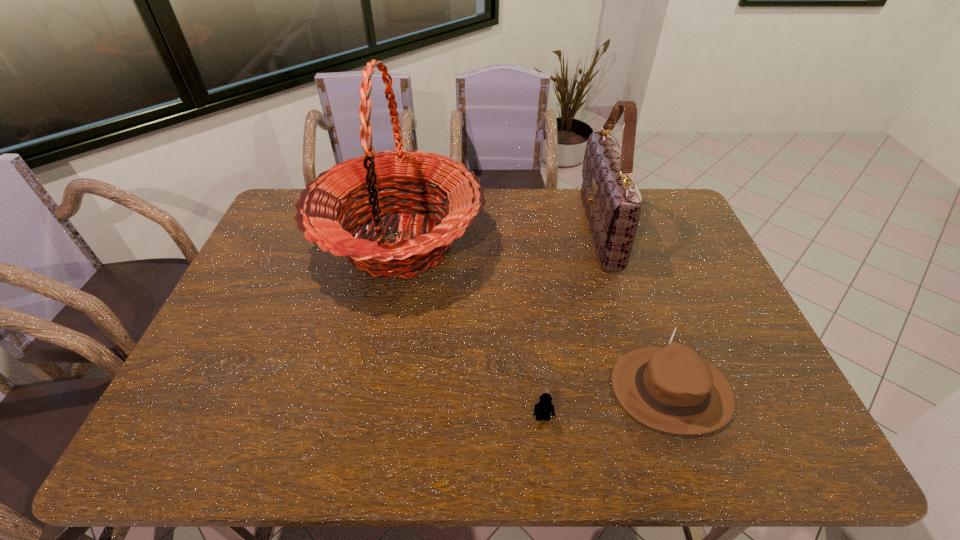
Where is `the tallest object`? The width and height of the screenshot is (960, 540). the tallest object is located at coordinates (320, 209).

Locate an element on the screen. This screenshot has height=540, width=960. basket is located at coordinates (320, 209).

In order to click on the second tallest object in this screenshot , I will do `click(612, 201)`.

This screenshot has width=960, height=540. Find the location of `fedora`. fedora is located at coordinates (671, 388).

The width and height of the screenshot is (960, 540). I want to click on the second object from left to right, so click(x=544, y=407).

The width and height of the screenshot is (960, 540). I want to click on the shortest object, so click(x=544, y=407).

You are a GUI agent. You are given a task and a screenshot of the screen. Output one action in this format:
    pyautogui.click(x=<x>, y=<y>)
    Task: Click on the free space located 0.350m on the front of the leftmost object
    The width and height of the screenshot is (960, 540).
    Given the screenshot: What is the action you would take?
    click(x=365, y=423)

The width and height of the screenshot is (960, 540). I want to click on vacant space located on the front of the third shortest object with the clasp, so click(x=491, y=230).

What are the coordinates of `free space located 0.070m on the front of the third shortest object with the clasp` in the screenshot? It's located at (564, 230).

Where is `free space located 0.060m on the front of the third shortest object with the clasp`? free space located 0.060m on the front of the third shortest object with the clasp is located at coordinates (566, 230).